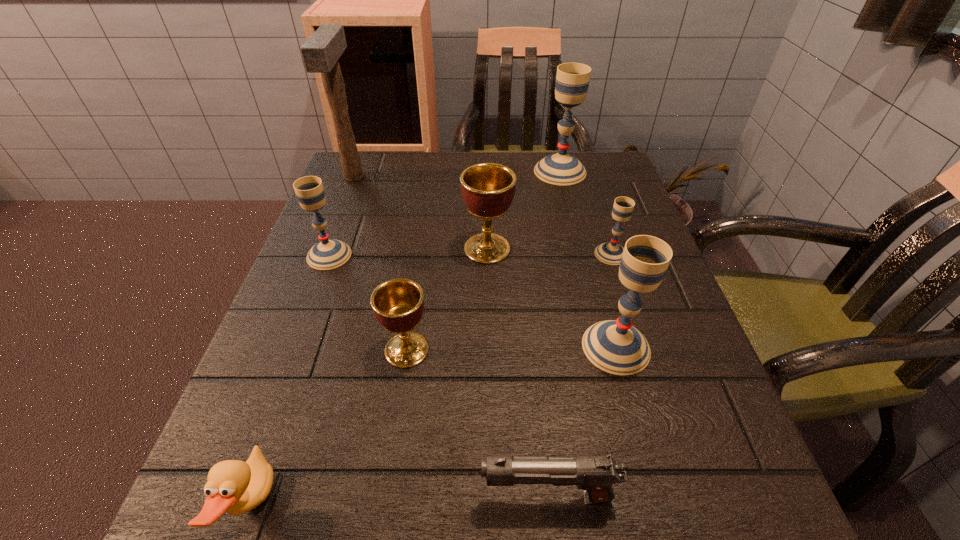
Where is `free spot between the biggest gray chalice and the smallest gray chalice`? free spot between the biggest gray chalice and the smallest gray chalice is located at coordinates (586, 213).

This screenshot has width=960, height=540. I want to click on free area in between the right golden chalice and the leftmost gray chalice, so click(408, 252).

I want to click on vacant area between the farthest gray chalice and the third smallest gray chalice, so click(588, 259).

The width and height of the screenshot is (960, 540). In order to click on object identified as the third closest to the second tallest object in this screenshot , I will do `click(320, 53)`.

Where is `the seventh closest object relative to the fifth chalice from right to left`? Image resolution: width=960 pixels, height=540 pixels. the seventh closest object relative to the fifth chalice from right to left is located at coordinates (320, 53).

Locate an element on the screen. chalice that stands as the third closest to the mallet is located at coordinates (572, 79).

Where is `chalice that is the closest one to the nearer golden chalice`? chalice that is the closest one to the nearer golden chalice is located at coordinates point(488,189).

Image resolution: width=960 pixels, height=540 pixels. Identify the location of the second closest gray chalice to the farthest gray chalice. (615, 346).

Where is `gray chalice identified as the closest to the tallest chalice`? This screenshot has width=960, height=540. gray chalice identified as the closest to the tallest chalice is located at coordinates (610, 253).

In order to click on vacant space that satisfies the following two spatial constraints: 1. on the front side of the smallest gray chalice; 2. in the direction the gun is aimed in this screenshot , I will do `click(690, 497)`.